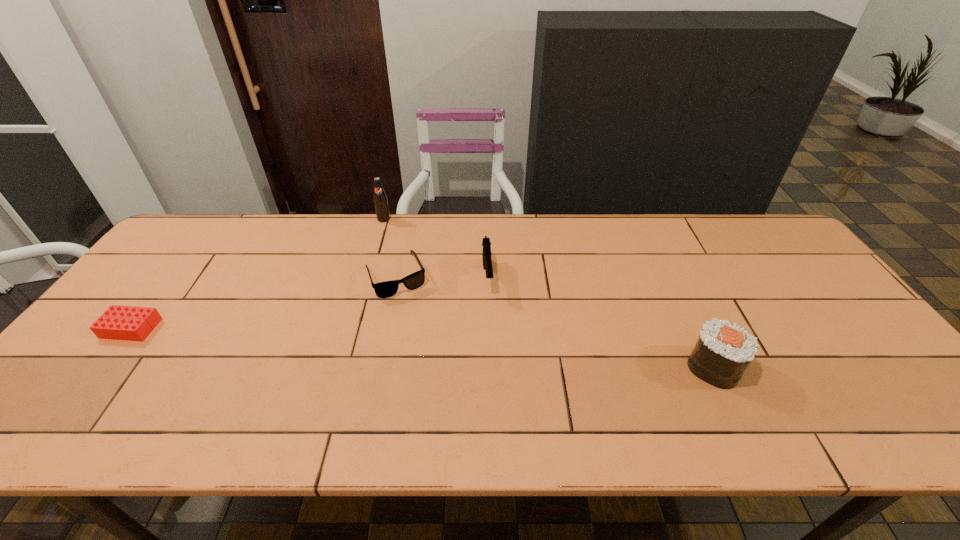
Locate an element on the screen. vacant area that lies between the fourth object from left to right and the sushi is located at coordinates (600, 322).

Where is `object that ranks as the fourth closest to the second nearest object`? The height and width of the screenshot is (540, 960). object that ranks as the fourth closest to the second nearest object is located at coordinates (723, 351).

Identify the location of object that is the closest to the sunglasses. The width and height of the screenshot is (960, 540). (486, 254).

Find the location of `vacant space that satisfies the following two spatial constraints: 1. on the front side of the farthest object; 2. on the left side of the sunglasses`. vacant space that satisfies the following two spatial constraints: 1. on the front side of the farthest object; 2. on the left side of the sunglasses is located at coordinates (368, 276).

Identify the location of vacant position in the image that satisfies the following two spatial constraints: 1. on the front side of the second shortest object; 2. on the right side of the second object from right to left. (395, 276).

Identify the location of free spot that satisfies the following two spatial constraints: 1. on the front side of the nearest object; 2. on the right side of the tallest object. Image resolution: width=960 pixels, height=540 pixels. (342, 367).

Identify the location of blank area in the image that satisfies the following two spatial constraints: 1. on the front side of the rightmost object; 2. on the left side of the fourth object from left to right. (489, 367).